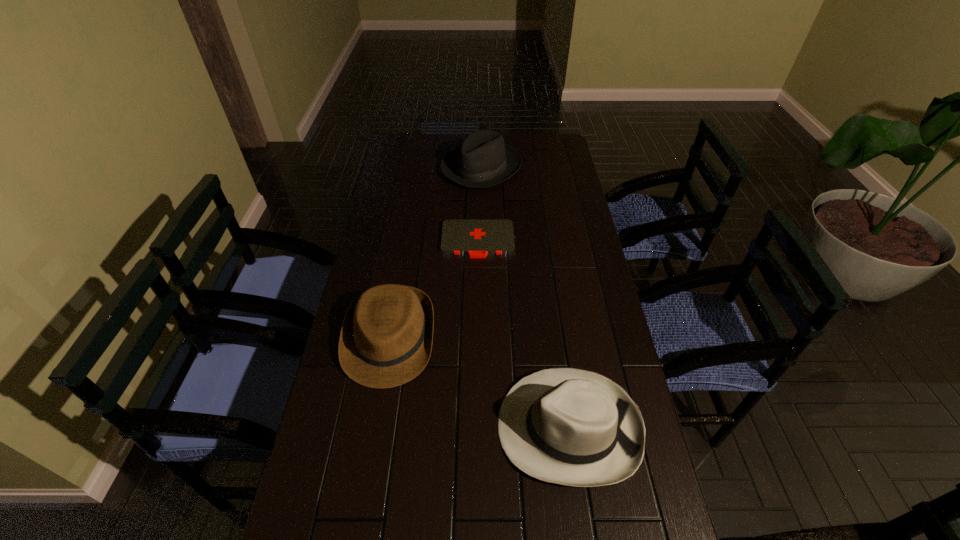
Select which fedora appears as the closest to the farthest object. Please provide its 2D coordinates. Your answer should be formatted as a tuple, i.e. [(x, y)], where the tuple contains the x and y coordinates of a point satisfying the conditions above.

[(386, 338)]

Identify the location of fedora that is the nearest to the second farthest object. (386, 338).